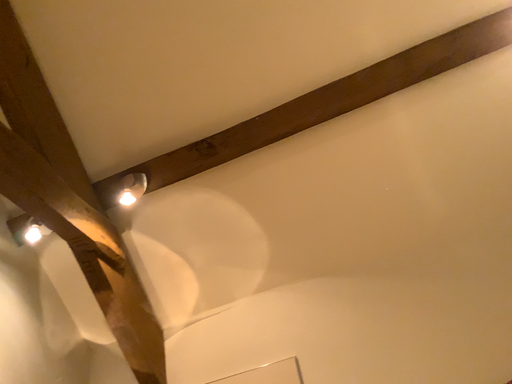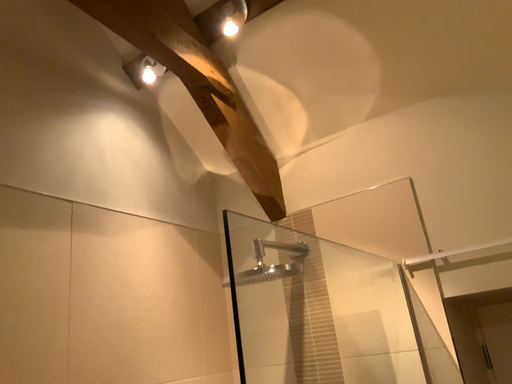
Question: Which way did the camera rotate in the video?

Choices:
 (A) rotated downward
 (B) rotated upward

Answer: (A)